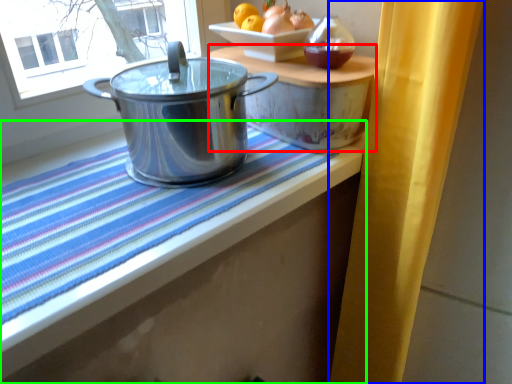
Question: Which object is positioned farthest from table (highlighted by a red box)? Select from curtain (highlighted by a blue box) and table (highlighted by a green box).

Choices:
 (A) curtain
 (B) table

Answer: (B)